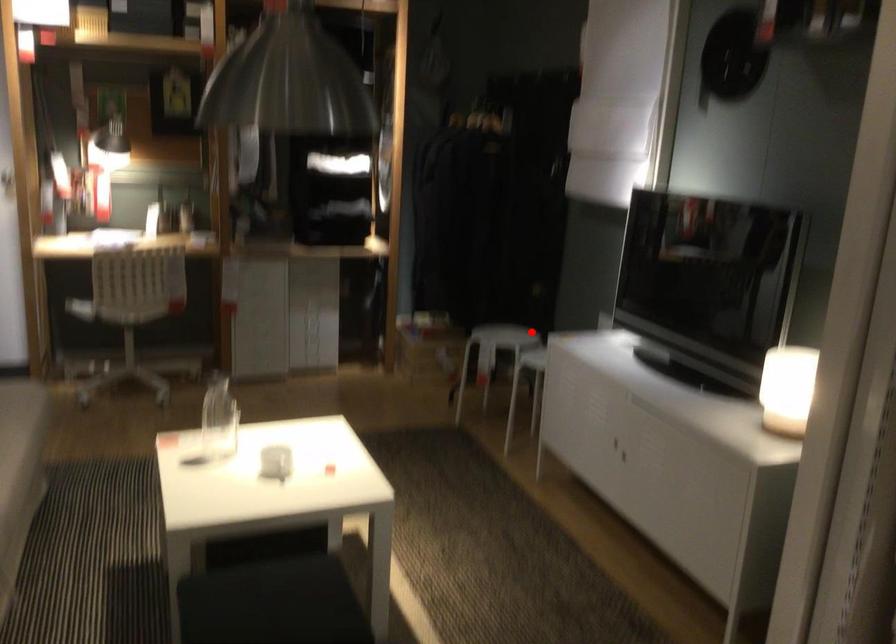
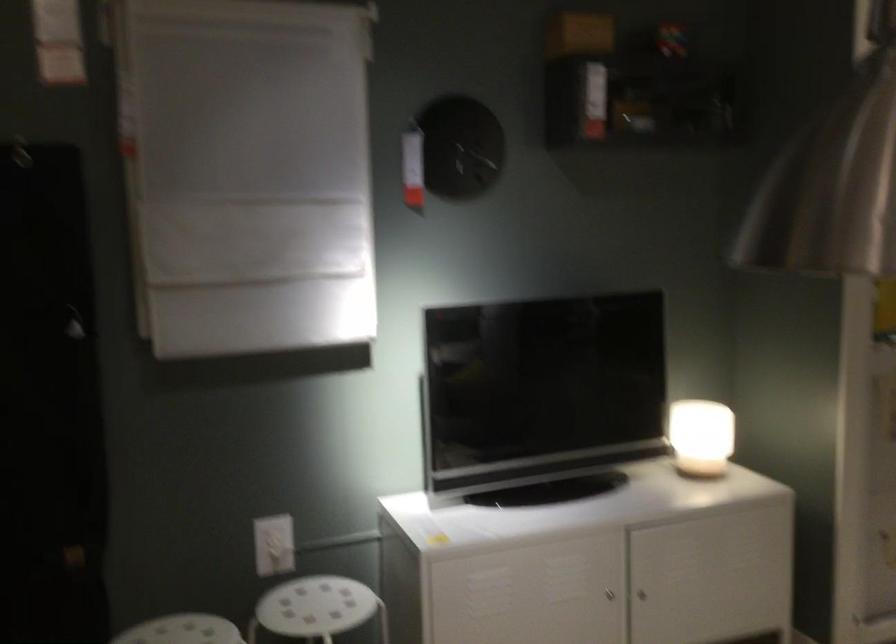
Where in the second image is the point corresponding to the highlighted location from the first image?

(182, 630)